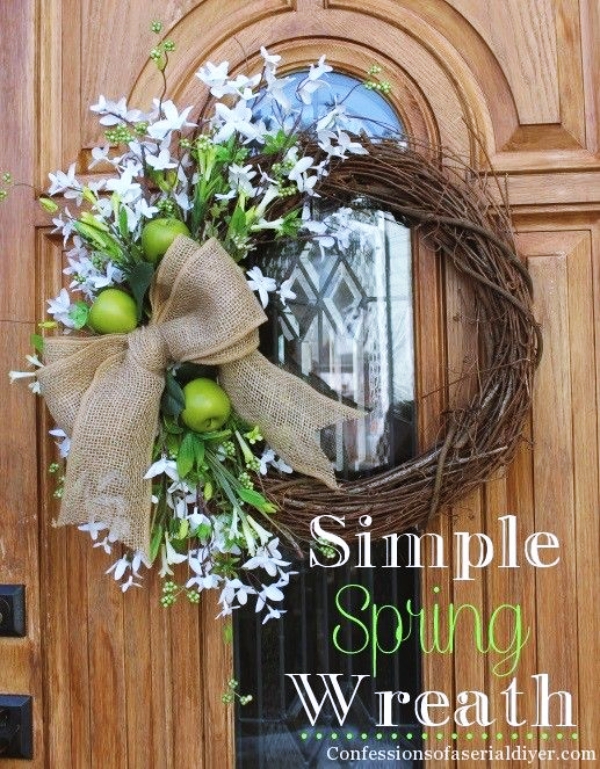
What are the coordinates of `glass door inset` in the screenshot? It's located at (340, 378), (336, 255), (338, 82).